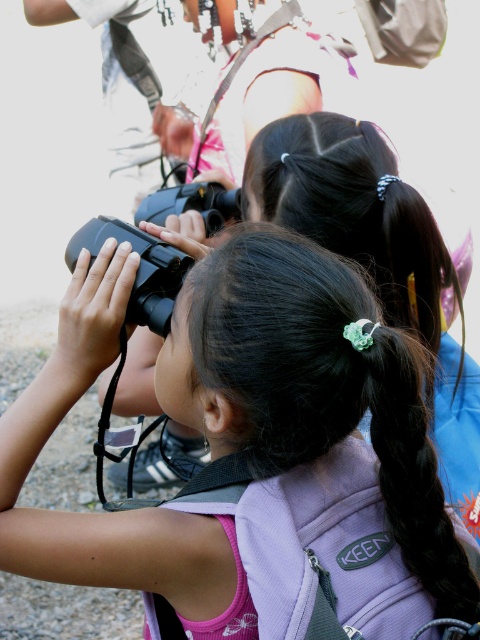
Question: Which point appears closest to the camera in this image?

Choices:
 (A) (462, 513)
 (B) (264, 442)

Answer: (B)

Question: Is black matte binoculars at center closer to camera compared to black silky hair at center?

Choices:
 (A) no
 (B) yes

Answer: (B)

Question: Can you confirm if black matte binoculars at center is positioned to the left of black silky hair at center?

Choices:
 (A) yes
 (B) no

Answer: (A)

Question: Which point is closer to the camera taking this photo?

Choices:
 (A) (288, 260)
 (B) (463, 436)

Answer: (A)

Question: Which point is farther to the camera?

Choices:
 (A) (282, 412)
 (B) (448, 413)

Answer: (B)

Question: Where is black matte binoculars at center located in relation to black silky hair at center in the image?

Choices:
 (A) left
 (B) right

Answer: (A)